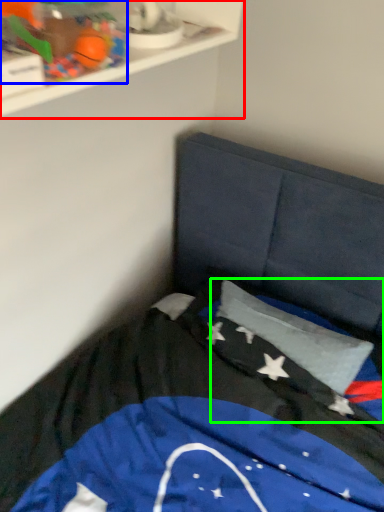
Question: Which object is the farthest from shelf (highlighted by a red box)? Choose among these: toy (highlighted by a blue box) or flag (highlighted by a green box).

Choices:
 (A) toy
 (B) flag

Answer: (B)